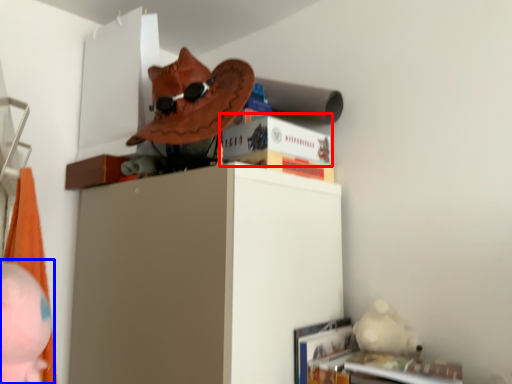
Question: Which point is closer to the camera, paperback book (highlighted by a red box) or person (highlighted by a blue box)?

Choices:
 (A) paperback book
 (B) person

Answer: (B)